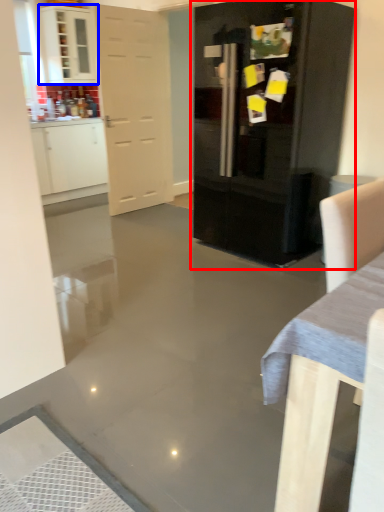
Question: Which object appears farthest to the camera in this image, cupboard (highlighted by a red box) or cabinetry (highlighted by a blue box)?

Choices:
 (A) cupboard
 (B) cabinetry

Answer: (B)